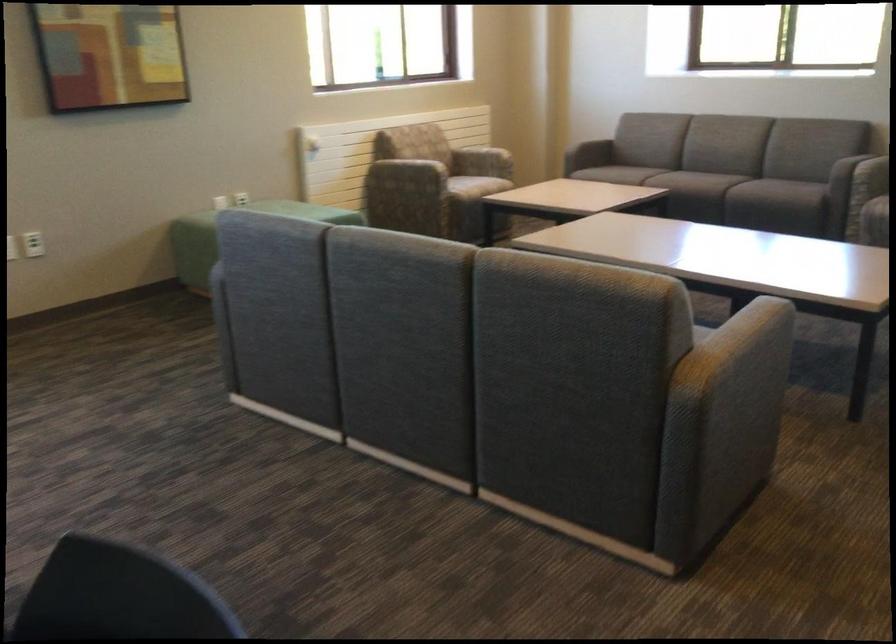
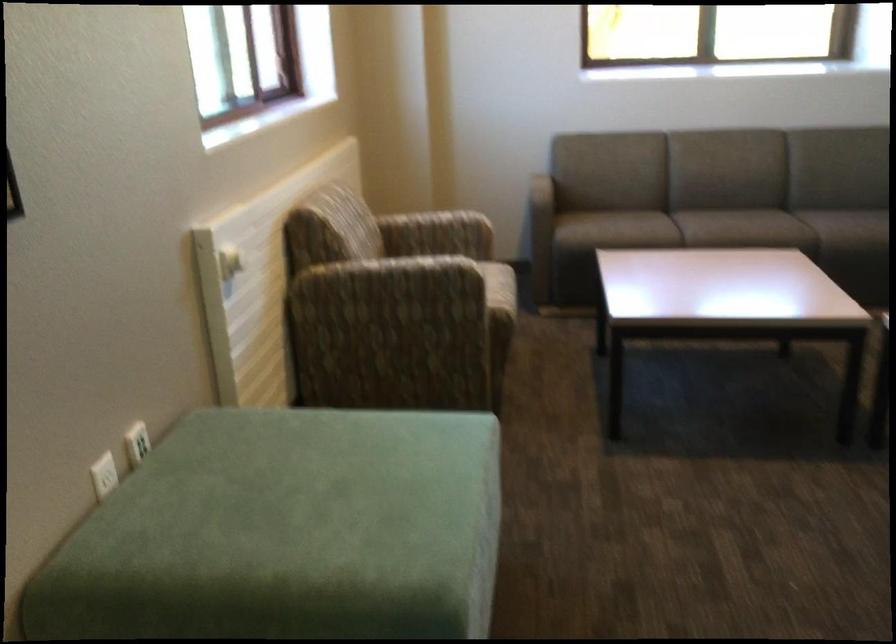
Find the pixel in the second image that matches pixel 302 140 in the first image.

(229, 263)